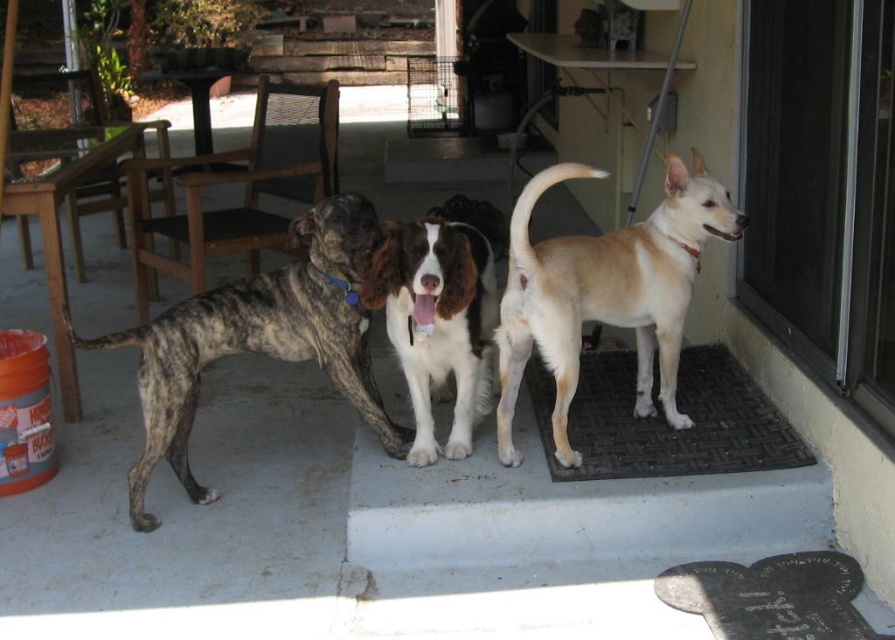
You are standing at the point labeled as point (823, 189). What object is directly in front of you?

The transparent glass door at upper right is directly in front of you at point (823, 189).

Based on the photo, you are standing on the concrete surface where the brindle fur dog at left is standing. You want to enter the house through the transparent glass door at upper right. Can you walk directly to the door without stepping off the concrete surface?

The transparent glass door at upper right is above the brindle fur dog at left, which suggests it is elevated or positioned higher than the current level. Since you are on the concrete surface, you would need to move upwards or find a path that leads to the door. However, the description does not mention any stairs or steps connecting the concrete surface to the door. Therefore, it might not be possible to reach the door directly without stepping off the concrete surface or using another pathway.